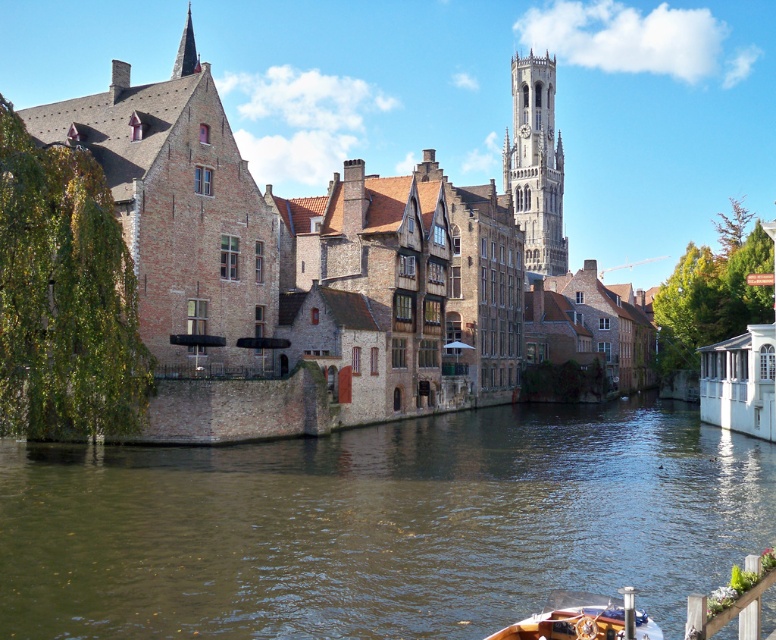
You are standing on the wooden polished boat at lower center in the canal. You want to reach the clock tower in the background. The path to the tower is along the canal. Given that the brown water at center is 13.79 meters away from your current position, can you estimate how far you need to travel along the canal to reach the base of the clock tower?

The brown water at center is 13.79 meters from the wooden polished boat at lower center. Since the path to the clock tower is along the canal and the brown water at center is part of the canal, you would need to travel approximately 13.79 meters along the canal to reach the base of the clock tower.